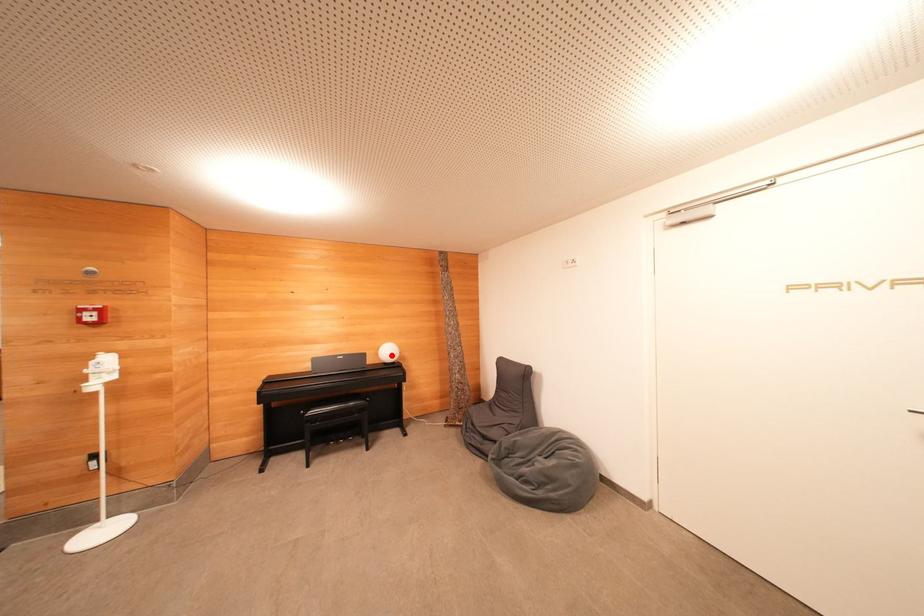
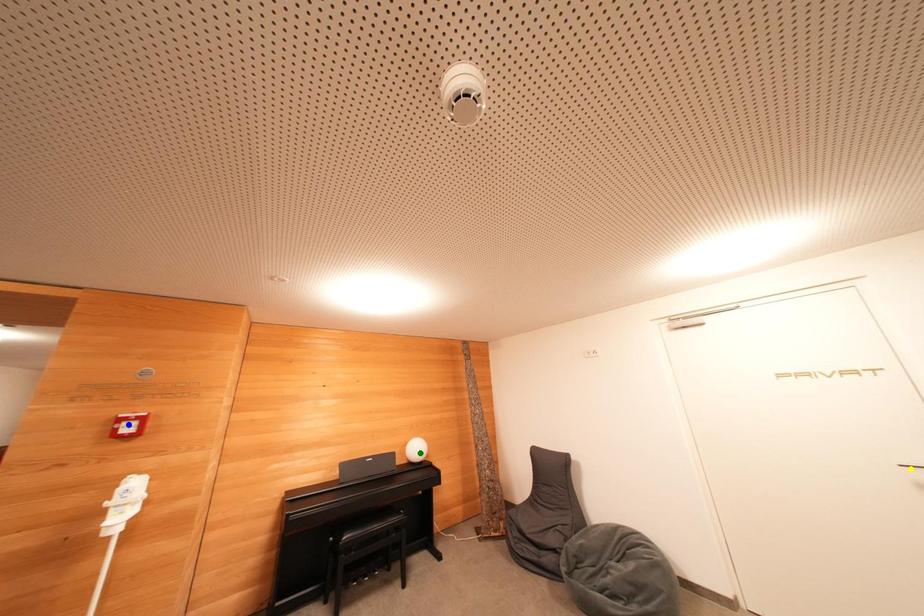
Question: I am providing you with two images of the same scene from different viewpoints. A red point is marked on the first image. You are given multiple points on the second image. In image 2, which mark is for the same physical point as the one in image 1?

Choices:
 (A) yellow point
 (B) green point
 (C) blue point

Answer: (B)